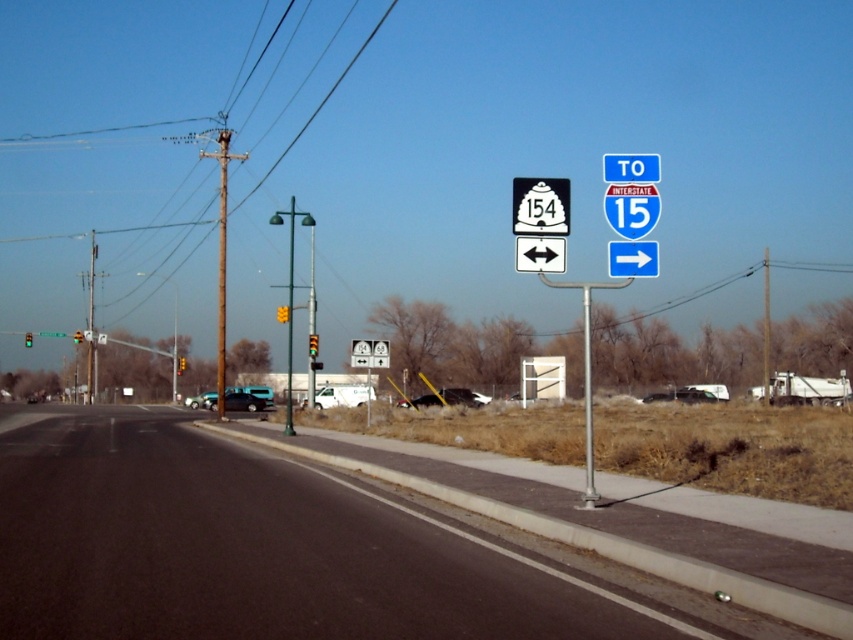
Question: Which object is the farthest from the green reflective traffic light at left?

Choices:
 (A) teal glossy van at lower left
 (B) yellow plastic traffic light at center
 (C) white matte van at center
 (D) green glass traffic light at left

Answer: (C)

Question: Is black matte car at center positioned at the back of green glass traffic light at left?

Choices:
 (A) yes
 (B) no

Answer: (B)

Question: Which point is farther to the camera?

Choices:
 (A) asphalt road at lower left
 (B) teal glossy van at lower left
 (C) yellow plastic traffic light at center
 (D) yellow glass traffic light at center

Answer: (C)

Question: Can you confirm if metallic silver sedan at center is smaller than yellow glass traffic light at upper center?

Choices:
 (A) no
 (B) yes

Answer: (B)

Question: Does black matte car at center come in front of metallic silver sedan at lower left?

Choices:
 (A) yes
 (B) no

Answer: (A)

Question: Which point appears farthest from the camera in this image?

Choices:
 (A) (207, 408)
 (B) (77, 333)
 (C) (654, 397)

Answer: (B)